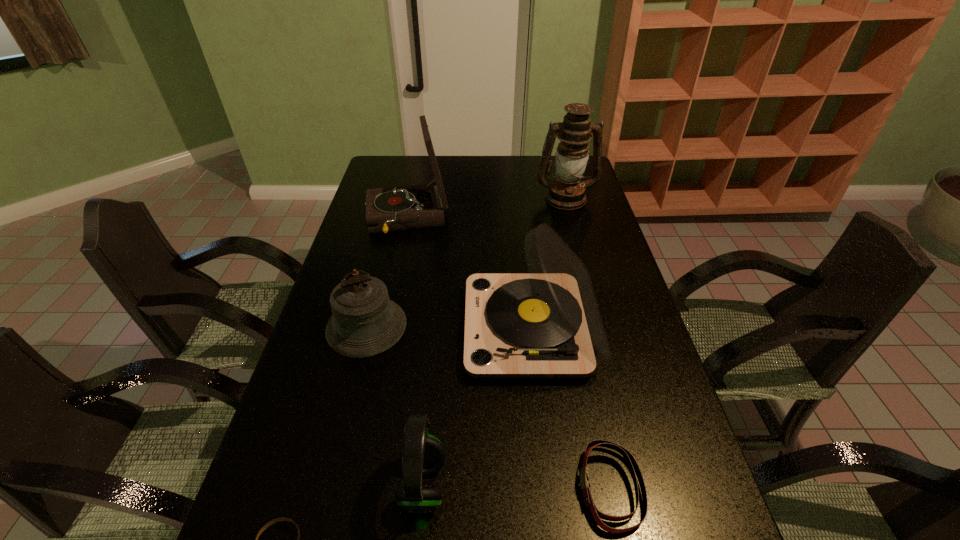
In order to click on vacant space located with the tonearm facing the front of the record player in this screenshot , I will do `click(403, 328)`.

Find the location of a particular element. The width and height of the screenshot is (960, 540). free space located 0.290m on the right of the bell is located at coordinates (512, 327).

The width and height of the screenshot is (960, 540). I want to click on vacant space located on the ear cups of the headset, so pos(579,485).

You are a GUI agent. You are given a task and a screenshot of the screen. Output one action in this format:
    pyautogui.click(x=<x>, y=<y>)
    Task: Click on the free space located on the back of the dog collar
    The image size is (960, 540).
    Given the screenshot: What is the action you would take?
    pyautogui.click(x=578, y=337)

The width and height of the screenshot is (960, 540). Find the location of `phonograph record located at the left edge`. phonograph record located at the left edge is located at coordinates (415, 206).

Find the location of a particular element. bell at the left edge is located at coordinates (365, 322).

The image size is (960, 540). I want to click on lantern positioned at the right edge, so click(567, 192).

Where is `record player located in the right edge section of the desktop`? record player located in the right edge section of the desktop is located at coordinates (546, 324).

Find the location of `dog collar present at the right edge`. dog collar present at the right edge is located at coordinates (631, 462).

In the image, there is a desktop. Identify the location of free space at the far edge. The image size is (960, 540). (472, 175).